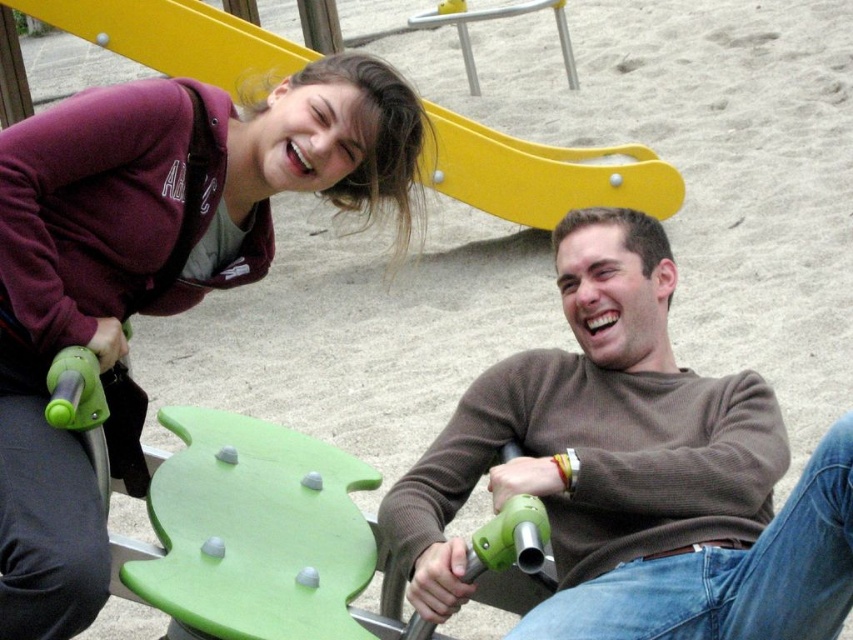
You are a photographer trying to capture both the brown textured sweater at center and the maroon fleece jacket at upper left in a single shot. Given their sizes, which one should you focus on to ensure both fit in the frame without cropping?

The brown textured sweater at center occupies less space than the maroon fleece jacket at upper left, so you should focus on the maroon fleece jacket at upper left to ensure both fit in the frame without cropping.